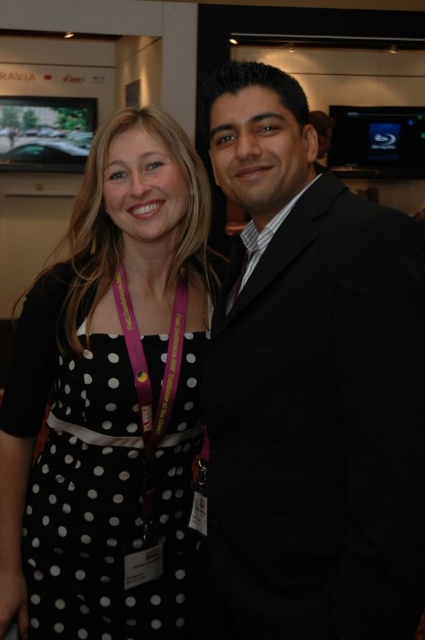
How much distance is there between black suit at right and black polka dot dress at center?

black suit at right is 29.22 centimeters away from black polka dot dress at center.

Is point (421, 371) more distant than point (150, 600)?

No, it is not.

At what (x,y) coordinates should I click in order to perform the action: click on black suit at right. Please return your answer as a coordinate pair (x, y). The height and width of the screenshot is (640, 425). Looking at the image, I should click on (311, 385).

Based on the photo, who is positioned more to the right, black polka dot dress at center or pink fabric lanyard at center?

Positioned to the right is pink fabric lanyard at center.

Consider the image. Is black polka dot dress at center smaller than pink fabric lanyard at center?

No, black polka dot dress at center is not smaller than pink fabric lanyard at center.

Between point (56, 413) and point (152, 468), which one is positioned behind?

The point (56, 413) is behind.

This screenshot has width=425, height=640. What are the coordinates of `black polka dot dress at center` in the screenshot? It's located at (110, 397).

In the scene shown: Between black dotted dress at center and pink fabric lanyard at center, which one appears on the left side from the viewer's perspective?

black dotted dress at center

What do you see at coordinates (105, 497) in the screenshot?
I see `black dotted dress at center` at bounding box center [105, 497].

The image size is (425, 640). Identify the location of black dotted dress at center. (105, 497).